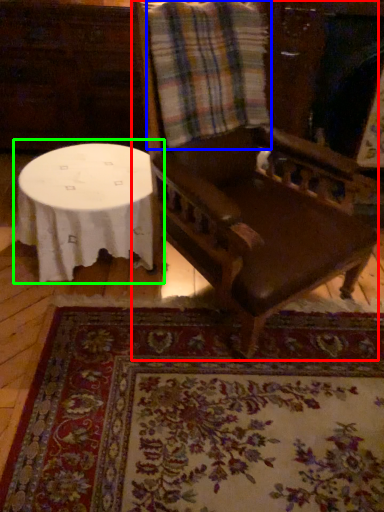
Question: Which object is positioned farthest from chair (highlighted by a red box)? Select from flannel (highlighted by a blue box) and table (highlighted by a green box).

Choices:
 (A) flannel
 (B) table

Answer: (B)